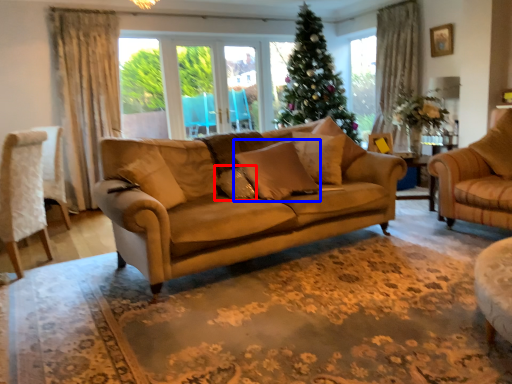
Question: Which point is further to the camera, pillow (highlighted by a red box) or pillow (highlighted by a blue box)?

Choices:
 (A) pillow
 (B) pillow

Answer: (A)